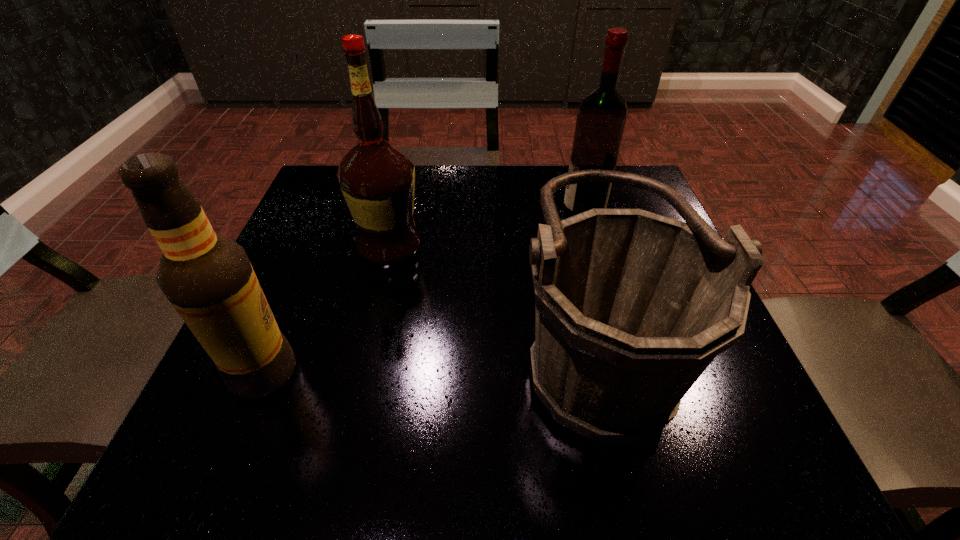
I want to click on blank region between the rightmost alcohol and the leftmost alcohol, so click(x=423, y=293).

Identify the location of free spot between the farthest object and the nearest alcohol. Image resolution: width=960 pixels, height=540 pixels. (423, 293).

Find the location of a particular element. The height and width of the screenshot is (540, 960). free space between the leftmost object and the second farthest alcohol is located at coordinates (326, 310).

This screenshot has height=540, width=960. What are the coordinates of `empty space between the leftmost alcohol and the farthest object` in the screenshot? It's located at (423, 293).

I want to click on free spot between the leftmost alcohol and the second alcohol from right to left, so click(326, 310).

Select which object appears as the closest to the second alcohol from left to right. Please provide its 2D coordinates. Your answer should be formatted as a tuple, i.e. [(x, y)], where the tuple contains the x and y coordinates of a point satisfying the conditions above.

[(631, 307)]

Image resolution: width=960 pixels, height=540 pixels. Identify the location of object that is the third closest to the rightmost alcohol. (209, 280).

Identify which alcohol is located as the third nearest to the bucket. Please provide its 2D coordinates. Your answer should be formatted as a tuple, i.e. [(x, y)], where the tuple contains the x and y coordinates of a point satisfying the conditions above.

[(209, 280)]

Select which alcohol appears as the second closest to the third nearest object. Please provide its 2D coordinates. Your answer should be formatted as a tuple, i.e. [(x, y)], where the tuple contains the x and y coordinates of a point satisfying the conditions above.

[(601, 117)]